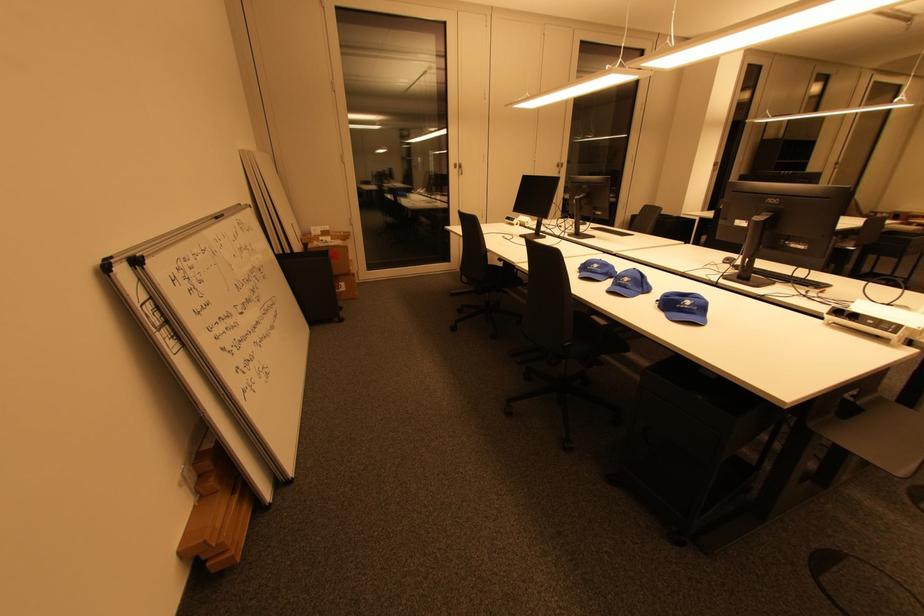
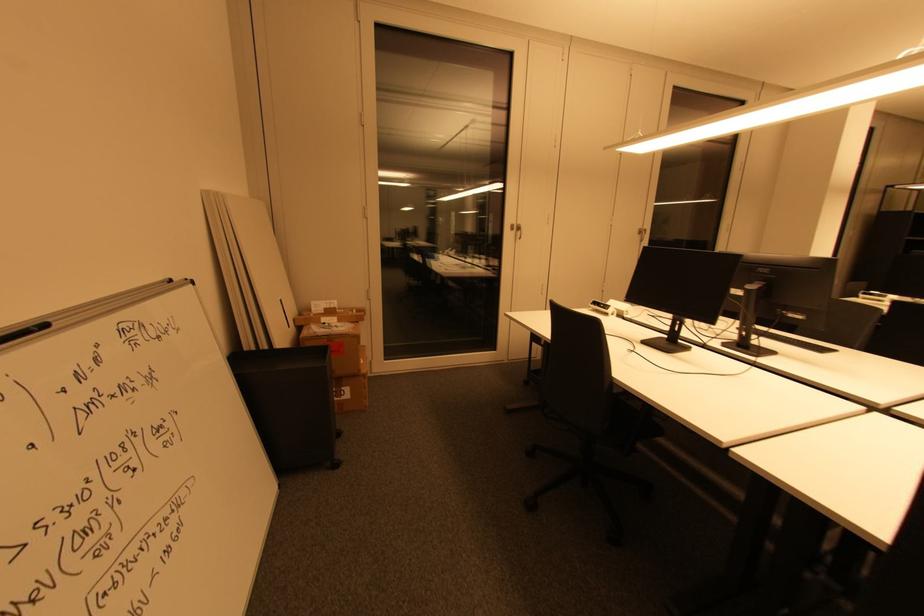
Question: What movement of the cameraman would produce the second image?

Choices:
 (A) Left
 (B) Right
 (C) Forward
 (D) Backward

Answer: (C)